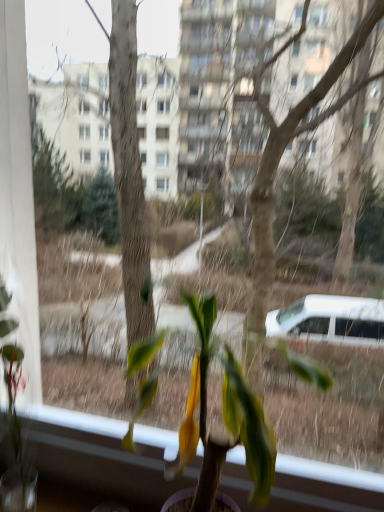
Question: From a real-world perspective, is green matte plant at left, which is counted as the 2th houseplant, starting from the right, above or below green matte plant at center, the 1th houseplant in the right-to-left sequence?

Choices:
 (A) above
 (B) below

Answer: (B)

Question: In terms of height, does green matte plant at left, which ranks as the first houseplant in left-to-right order, look taller or shorter compared to green matte plant at center, the 1th houseplant in the right-to-left sequence?

Choices:
 (A) tall
 (B) short

Answer: (A)

Question: In the image, is green matte plant at left, which ranks as the first houseplant in left-to-right order, on the left side or the right side of green matte plant at center, arranged as the 2th houseplant when viewed from the left?

Choices:
 (A) right
 (B) left

Answer: (B)

Question: In terms of height, does green matte plant at center, the 1th houseplant in the right-to-left sequence, look taller or shorter compared to green matte plant at left, which is counted as the 2th houseplant, starting from the right?

Choices:
 (A) tall
 (B) short

Answer: (B)

Question: From a real-world perspective, is green matte plant at center, arranged as the 2th houseplant when viewed from the left, physically located above or below green matte plant at left, which is counted as the 2th houseplant, starting from the right?

Choices:
 (A) below
 (B) above

Answer: (B)

Question: Is green matte plant at center, arranged as the 2th houseplant when viewed from the left, situated inside green matte plant at left, which ranks as the first houseplant in left-to-right order, or outside?

Choices:
 (A) outside
 (B) inside

Answer: (A)

Question: Would you say green matte plant at center, arranged as the 2th houseplant when viewed from the left, is to the left or to the right of green matte plant at left, which is counted as the 2th houseplant, starting from the right, in the picture?

Choices:
 (A) right
 (B) left

Answer: (A)